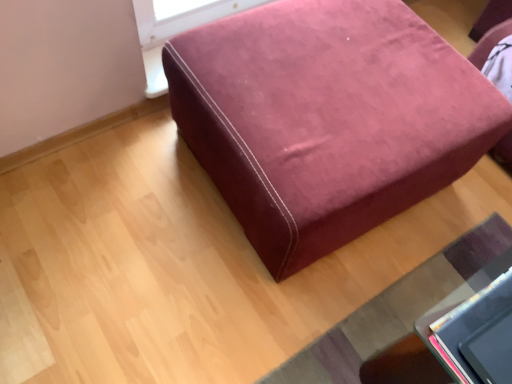
Find the location of a particular element. free space in front of velvet-like burgundy ottoman at center is located at coordinates (253, 303).